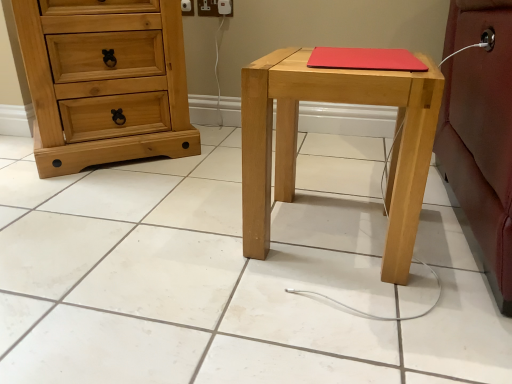
The height and width of the screenshot is (384, 512). I want to click on vacant space to the right of natural wood chest of drawers at left, so click(x=216, y=156).